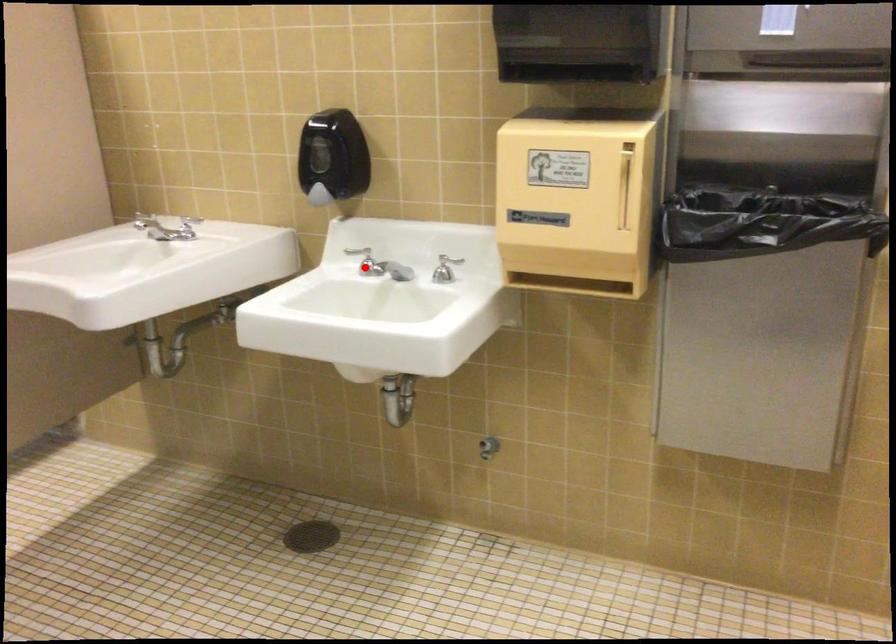
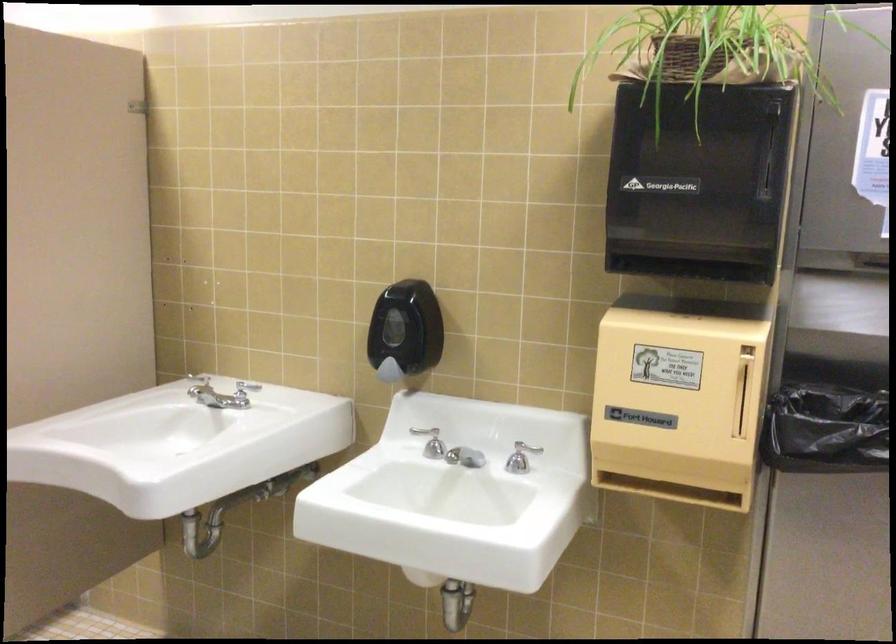
In the second image, find the point that corresponds to the highlighted location in the first image.

(433, 444)